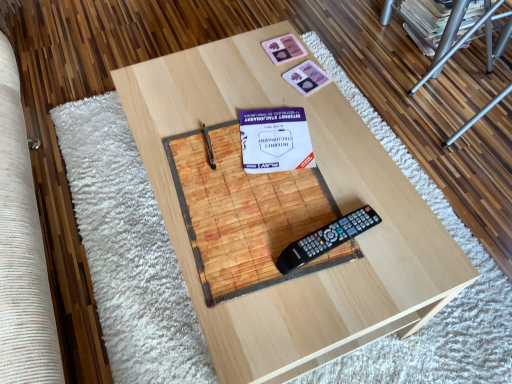
The height and width of the screenshot is (384, 512). Identify the location of empty space that is ontop of white paper at center (from a real-world perspective). (279, 137).